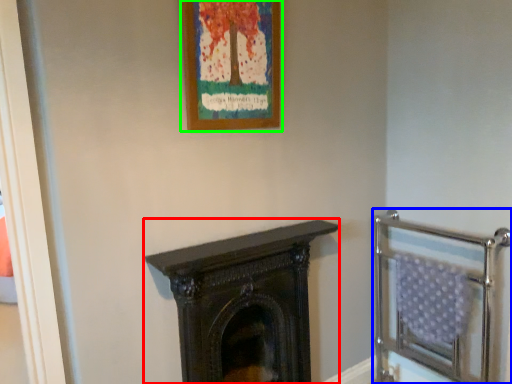
Question: Considering the real-world distances, which object is farthest from fireplace (highlighted by a red box)? balustrade (highlighted by a blue box) or picture frame (highlighted by a green box)?

Choices:
 (A) balustrade
 (B) picture frame

Answer: (B)